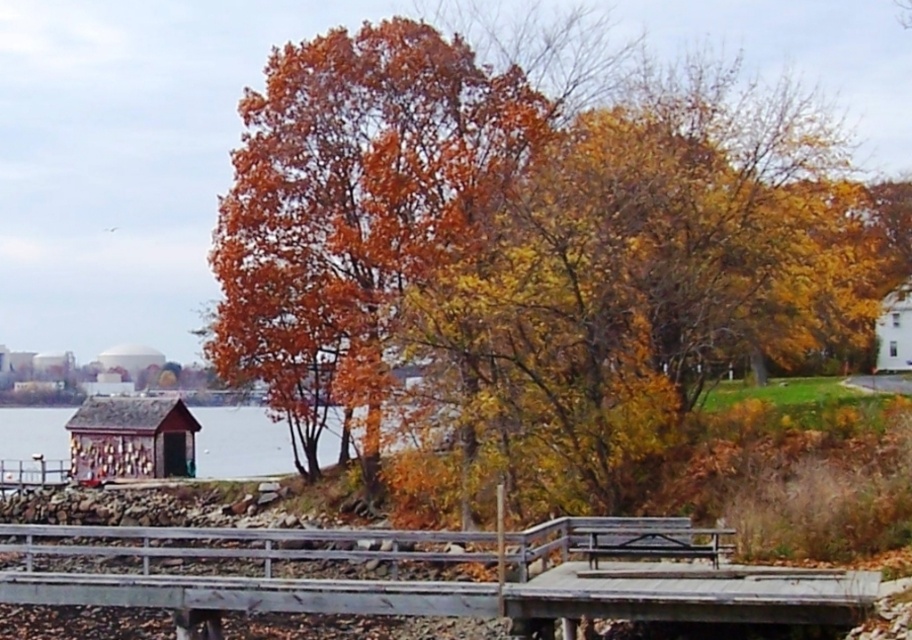
Who is more forward, (x=295, y=182) or (x=333, y=435)?

Point (x=295, y=182)

In the scene shown: Can you confirm if orange matte tree at center is smaller than smooth wooden dock at lower left?

Correct, orange matte tree at center occupies less space than smooth wooden dock at lower left.

The image size is (912, 640). What do you see at coordinates (353, 211) in the screenshot?
I see `orange matte tree at center` at bounding box center [353, 211].

Where is `orange matte tree at center`? This screenshot has width=912, height=640. orange matte tree at center is located at coordinates (353, 211).

Does orange matte tree at center appear on the left side of gray wooden bridge at lower center?

In fact, orange matte tree at center is to the right of gray wooden bridge at lower center.

Does orange matte tree at center come in front of gray wooden bridge at lower center?

No, orange matte tree at center is behind gray wooden bridge at lower center.

Describe the element at coordinates (353, 211) in the screenshot. This screenshot has width=912, height=640. I see `orange matte tree at center` at that location.

You are a GUI agent. You are given a task and a screenshot of the screen. Output one action in this format:
    pyautogui.click(x=<x>, y=<y>)
    Task: Click on the orange matte tree at center
    
    Given the screenshot: What is the action you would take?
    [353, 211]

Locate an element on the screen. This screenshot has height=640, width=912. gray wooden bridge at lower center is located at coordinates (428, 573).

Which of these two, gray wooden bridge at lower center or smooth wooden dock at lower left, stands shorter?

With less height is smooth wooden dock at lower left.

Is point (664, 573) less distant than point (224, 472)?

Yes, it is in front of point (224, 472).

Where is `gray wooden bridge at lower center`? The width and height of the screenshot is (912, 640). gray wooden bridge at lower center is located at coordinates (428, 573).